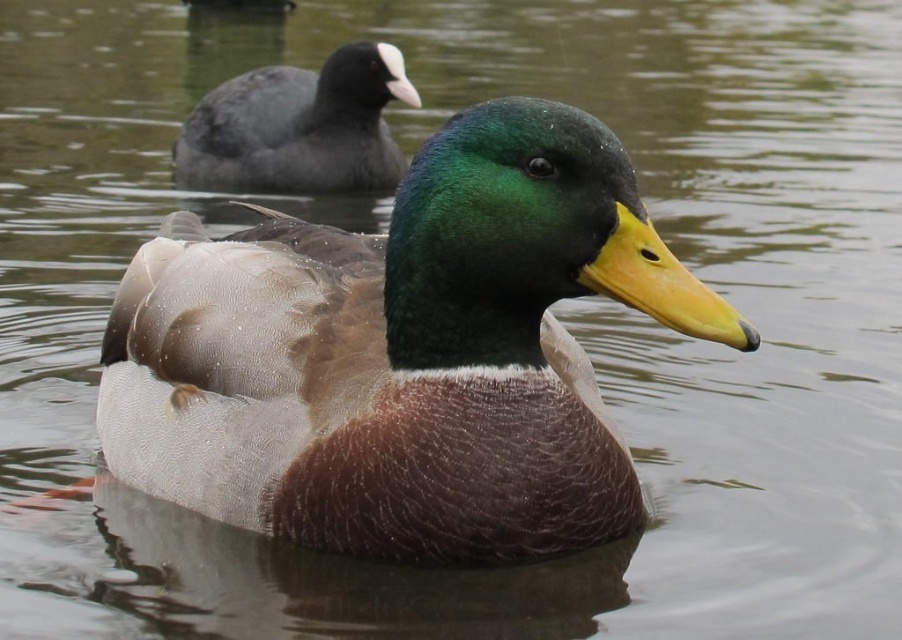
Can you confirm if green glossy duck at center is shorter than matte gray duck at upper left?

Incorrect, green glossy duck at center's height does not fall short of matte gray duck at upper left's.

Is green glossy duck at center positioned before matte gray duck at upper left?

That is True.

Which is in front, point (532, 237) or point (410, 86)?

Point (532, 237) is more forward.

Identify the location of green glossy duck at center. This screenshot has width=902, height=640. (403, 353).